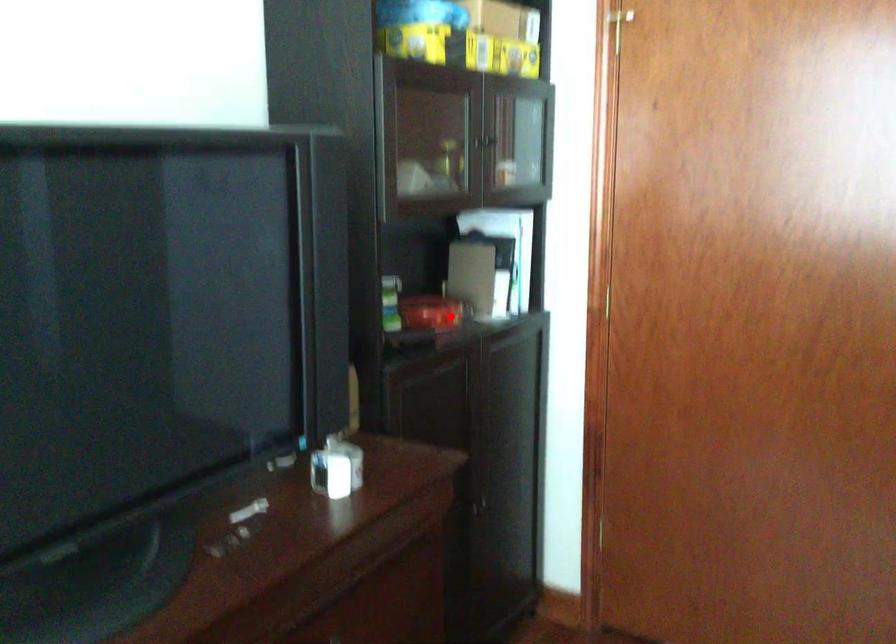
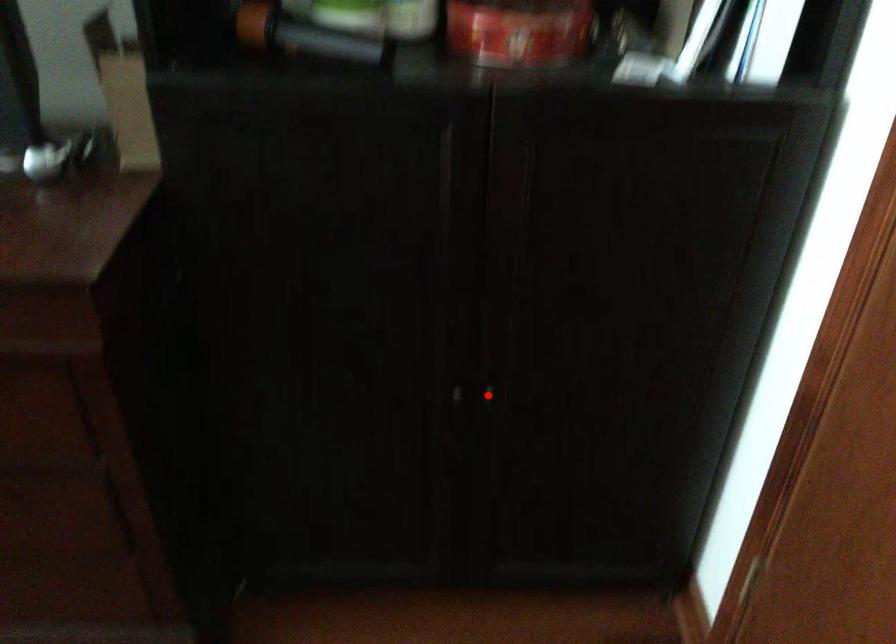
I am providing you with two images of the same scene from different viewpoints. A red point is marked on the first image and another point is marked on the second image. Is the red point in image1 aligned with the point shown in image2?

No